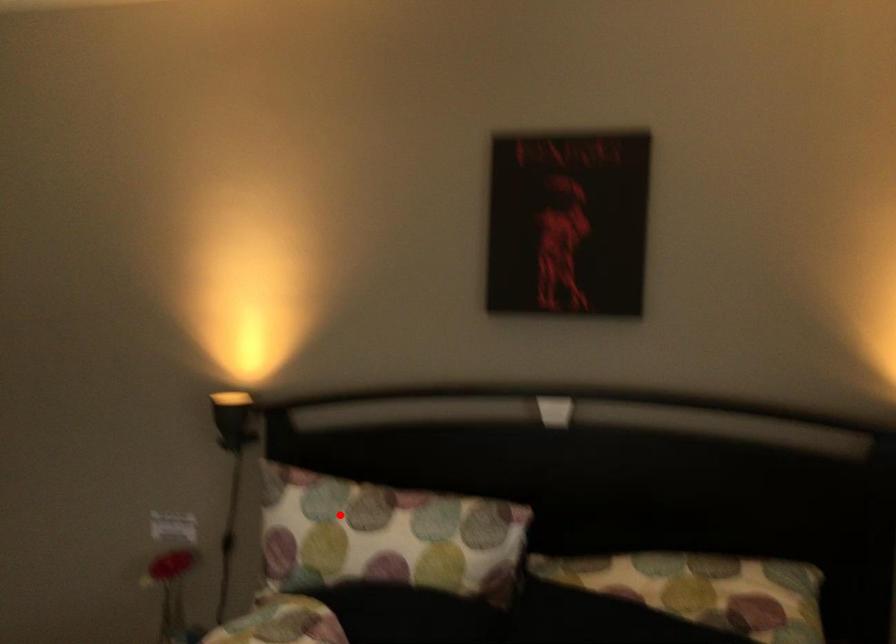
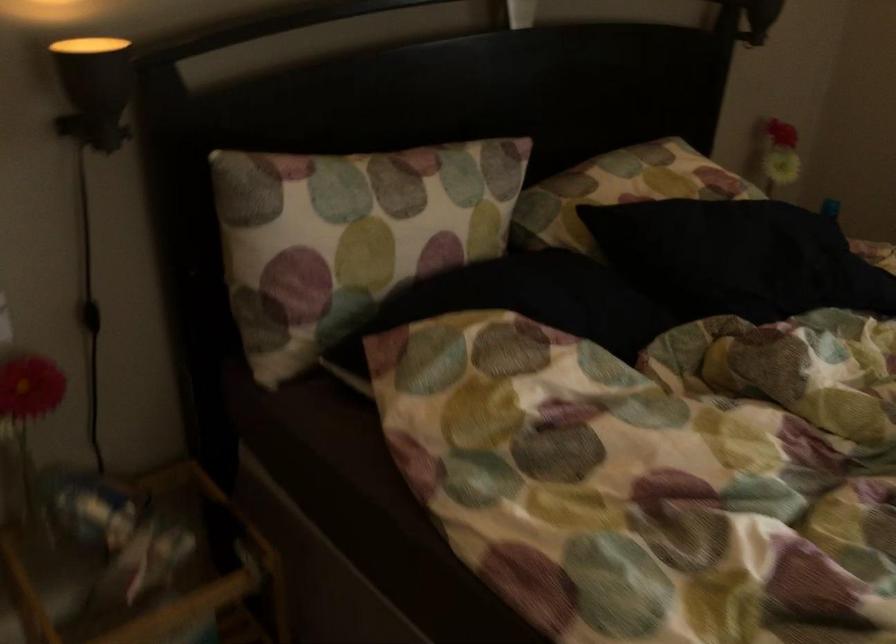
In the second image, find the point that corresponds to the highlighted location in the first image.

(367, 207)